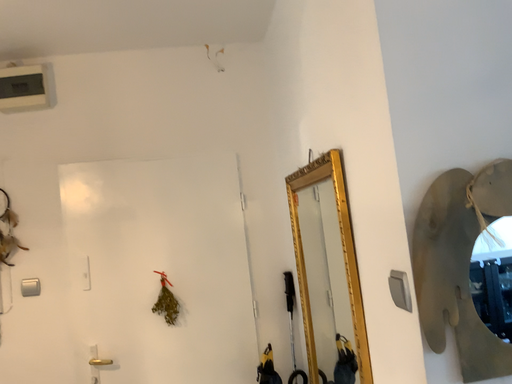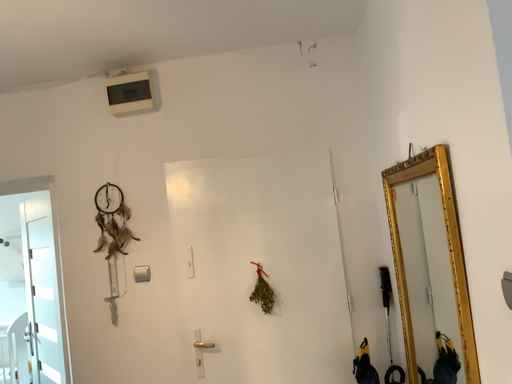
Question: How did the camera likely rotate when shooting the video?

Choices:
 (A) rotated right
 (B) rotated left

Answer: (B)